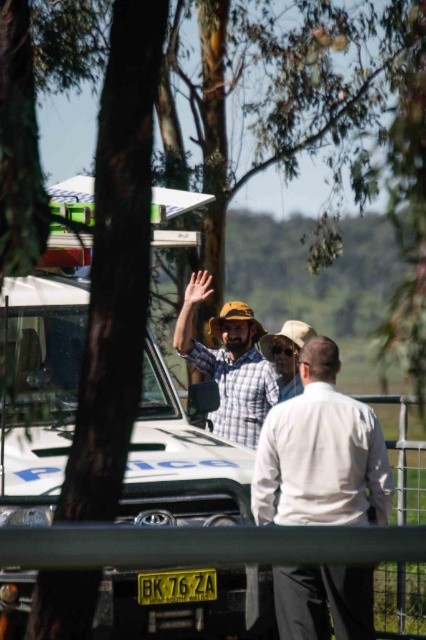
Question: Which point is farther from the camera taking this photo?

Choices:
 (A) (9, 518)
 (B) (221, 388)
 (C) (342, 508)

Answer: (B)

Question: Does white matte shirt at center have a smaller size compared to yellow matte license plate at center?

Choices:
 (A) no
 (B) yes

Answer: (A)

Question: Which of the following is the farthest from the observer?

Choices:
 (A) metallic silver fence at lower center
 (B) checkered fabric shirt at center
 (C) white matte shirt at center

Answer: (A)

Question: Can you confirm if white matte shirt at center is positioned to the left of yellow matte license plate at center?

Choices:
 (A) no
 (B) yes

Answer: (A)

Question: Does white matte shirt at center appear under yellow matte license plate at center?

Choices:
 (A) no
 (B) yes

Answer: (A)

Question: Which of these objects is positioned closest to the white matte shirt at center?

Choices:
 (A) checkered fabric shirt at center
 (B) white matte police car at center
 (C) yellow matte license plate at center

Answer: (C)